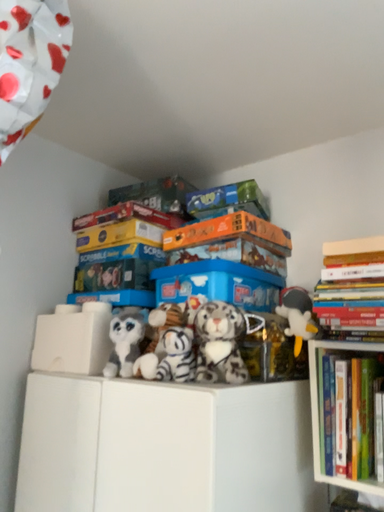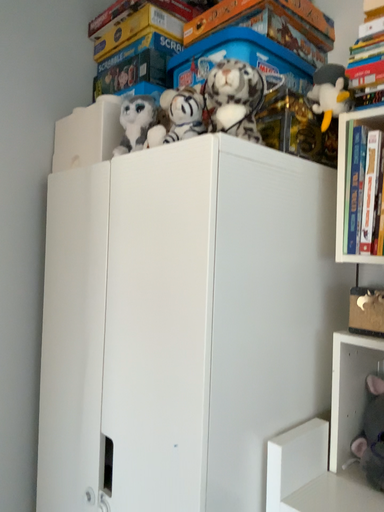
Question: How did the camera likely rotate when shooting the video?

Choices:
 (A) rotated downward
 (B) rotated upward

Answer: (A)